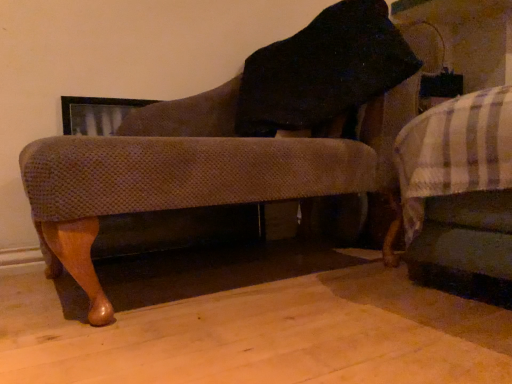
Question: Should I look upward or downward to see white striped fabric bed at right?

Choices:
 (A) up
 (B) down

Answer: (A)

Question: Is textured fabric chair at center to the left of white striped fabric bed at right from the viewer's perspective?

Choices:
 (A) yes
 (B) no

Answer: (A)

Question: Can you confirm if textured fabric chair at center is shorter than white striped fabric bed at right?

Choices:
 (A) no
 (B) yes

Answer: (A)

Question: Is textured fabric chair at center at the right side of white striped fabric bed at right?

Choices:
 (A) no
 (B) yes

Answer: (A)

Question: Is textured fabric chair at center not within white striped fabric bed at right?

Choices:
 (A) no
 (B) yes

Answer: (B)

Question: Does textured fabric chair at center come behind white striped fabric bed at right?

Choices:
 (A) yes
 (B) no

Answer: (B)

Question: From the image's perspective, would you say textured fabric chair at center is shown under white striped fabric bed at right?

Choices:
 (A) yes
 (B) no

Answer: (B)

Question: Is white striped fabric bed at right positioned beyond the bounds of textured fabric chair at center?

Choices:
 (A) yes
 (B) no

Answer: (A)

Question: Considering the relative positions of white striped fabric bed at right and textured fabric chair at center in the image provided, is white striped fabric bed at right in front of textured fabric chair at center?

Choices:
 (A) no
 (B) yes

Answer: (A)

Question: From a real-world perspective, is white striped fabric bed at right positioned over textured fabric chair at center based on gravity?

Choices:
 (A) no
 (B) yes

Answer: (A)

Question: Considering the relative sizes of white striped fabric bed at right and textured fabric chair at center in the image provided, is white striped fabric bed at right bigger than textured fabric chair at center?

Choices:
 (A) no
 (B) yes

Answer: (A)

Question: From a real-world perspective, is white striped fabric bed at right located beneath textured fabric chair at center?

Choices:
 (A) yes
 (B) no

Answer: (A)

Question: Is white striped fabric bed at right thinner than textured fabric chair at center?

Choices:
 (A) no
 (B) yes

Answer: (A)

Question: Considering the positions of white striped fabric bed at right and textured fabric chair at center in the image, is white striped fabric bed at right bigger or smaller than textured fabric chair at center?

Choices:
 (A) small
 (B) big

Answer: (A)